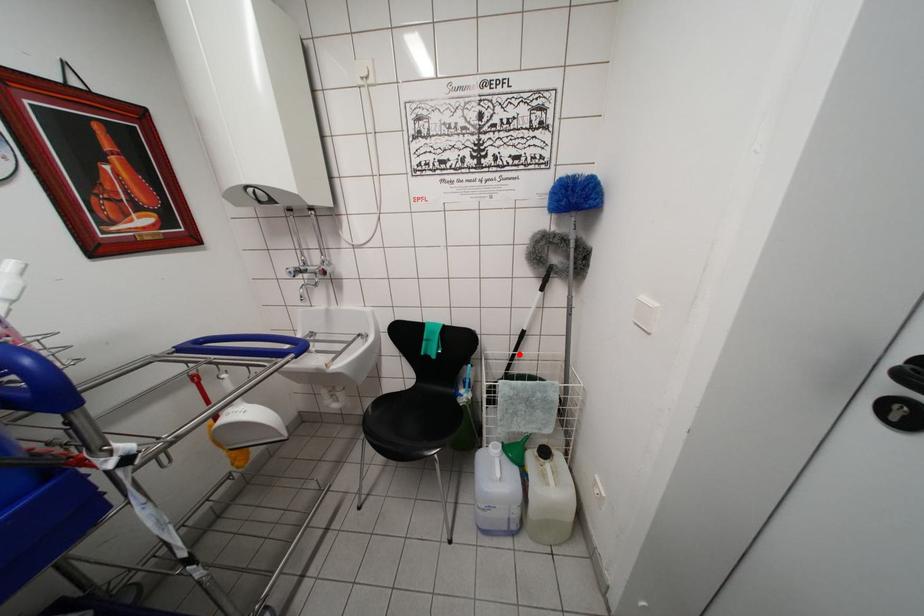
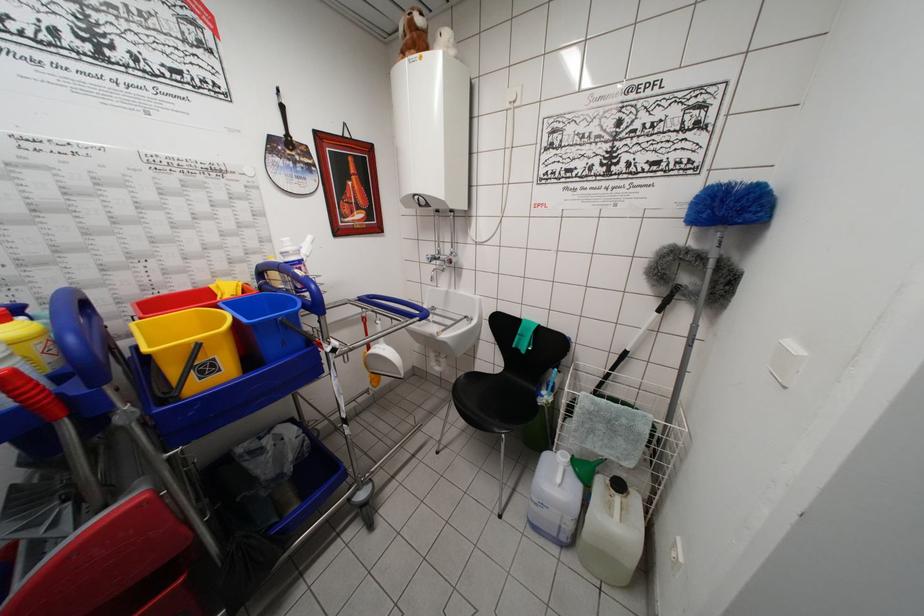
Question: I am providing you with two images of the same scene from different viewpoints. A red point is marked on the first image. Is the red point's position out of view in image 2?

Choices:
 (A) Yes
 (B) No

Answer: (B)